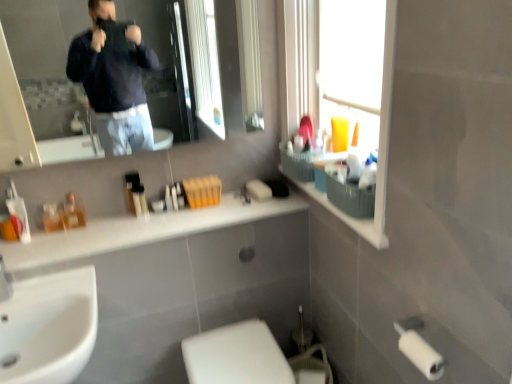
You are a GUI agent. You are given a task and a screenshot of the screen. Output one action in this format:
    pyautogui.click(x=<x>, y=<y>)
    Task: Click on the free location to the right of brushed metal faucet at lower left
    The image size is (512, 384).
    Given the screenshot: What is the action you would take?
    pyautogui.click(x=57, y=284)